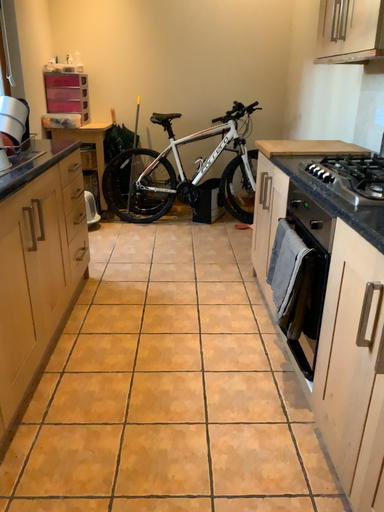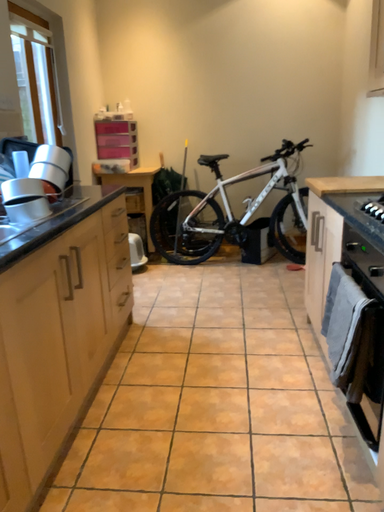
Question: How did the camera likely rotate when shooting the video?

Choices:
 (A) rotated right
 (B) rotated left

Answer: (B)